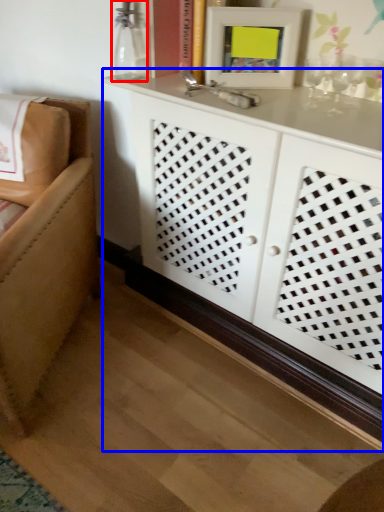
Question: Which of the following is the farthest to the observer, glass vase (highlighted by a red box) or cabinetry (highlighted by a blue box)?

Choices:
 (A) glass vase
 (B) cabinetry

Answer: (A)